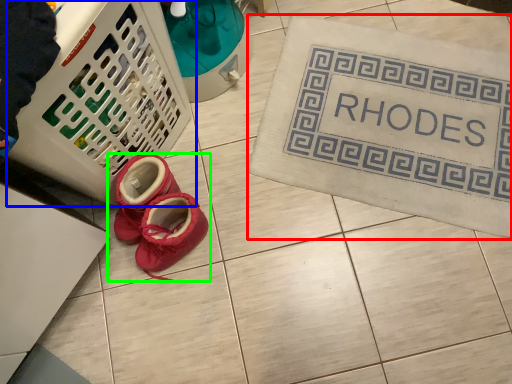
Question: Which object is the farthest from bath mat (highlighted by a red box)? Choose among these: basket (highlighted by a blue box) or footwear (highlighted by a green box).

Choices:
 (A) basket
 (B) footwear

Answer: (A)